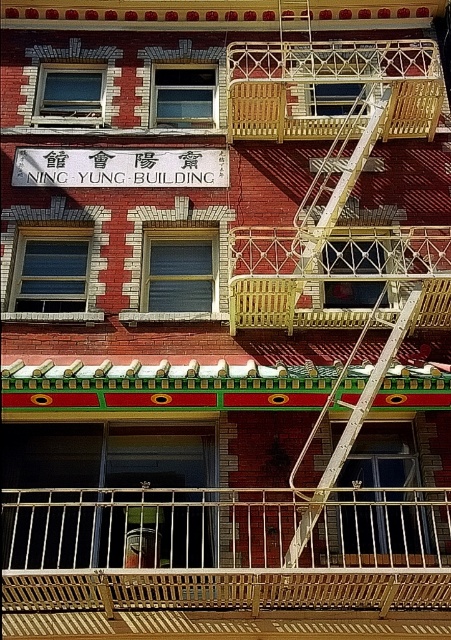
Does wooden at center appear on the right side of white metal fire escape at upper center?

Indeed, wooden at center is positioned on the right side of white metal fire escape at upper center.

Can you confirm if wooden at center is thinner than white metal fire escape at upper center?

No.

Find the location of a particular element. wooden at center is located at coordinates [335, 275].

Is white metal fire escape at center in front of white metal fire escape at upper center?

Yes, it is.

The height and width of the screenshot is (640, 451). Describe the element at coordinates (353, 426) in the screenshot. I see `white metal fire escape at center` at that location.

Who is more distant from viewer, (294,554) or (359,154)?

Positioned behind is point (359,154).

The width and height of the screenshot is (451, 640). Find the location of `white metal fire escape at center`. white metal fire escape at center is located at coordinates (353, 426).

Between point (47, 154) and point (348, 189), which one is positioned in front?

Point (348, 189) is more forward.

Between white matte sign at center and white metal fire escape at upper center, which one appears on the right side from the viewer's perspective?

Positioned to the right is white metal fire escape at upper center.

The width and height of the screenshot is (451, 640). I want to click on white matte sign at center, so click(x=120, y=168).